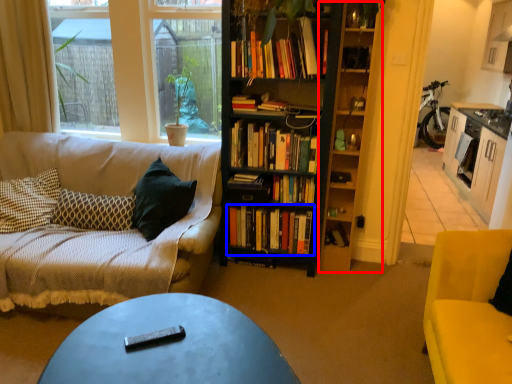
Question: Which object appears farthest to the camera in this image, shelf (highlighted by a red box) or book (highlighted by a blue box)?

Choices:
 (A) shelf
 (B) book

Answer: (B)